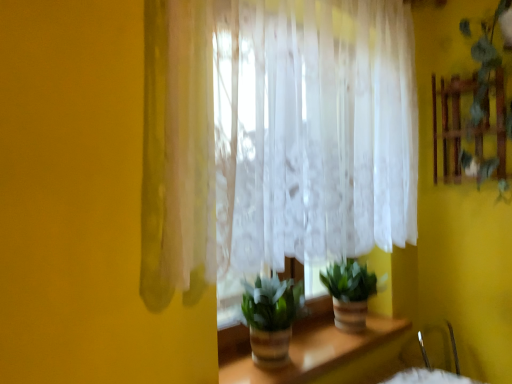
Where is `vacant area situated below green matte plant at center, placed as the 1th houseplant when sorted from back to front (from a real-world perspective)`? The height and width of the screenshot is (384, 512). vacant area situated below green matte plant at center, placed as the 1th houseplant when sorted from back to front (from a real-world perspective) is located at coordinates (357, 332).